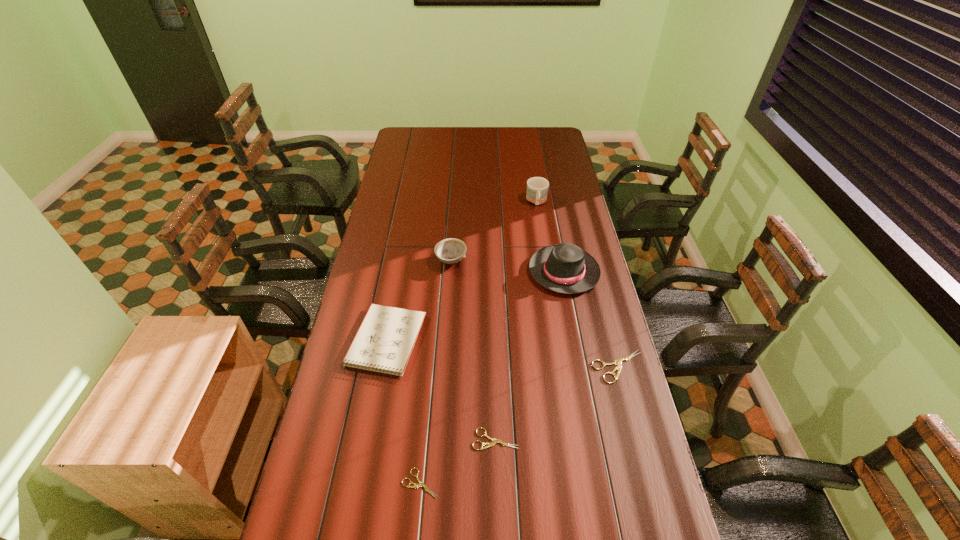
Locate an element on the screen. vacant region between the second shears from left to right and the dress hat is located at coordinates (530, 355).

What are the coordinates of `vacant area that lies between the farthest object and the bowl` in the screenshot? It's located at (493, 231).

Identify the location of vacant area between the rightmost shears and the dress hat. (591, 319).

At what (x,y) coordinates should I click in order to perform the action: click on unoccupied position between the tallest shears and the sixth tallest object. Please return your answer as a coordinate pair (x, y). This screenshot has width=960, height=540. Looking at the image, I should click on (557, 403).

Locate an element on the screen. free spot between the fourth tallest object and the nearest object is located at coordinates (403, 413).

Where is `vacant space in between the dress hat and the second shortest object`? vacant space in between the dress hat and the second shortest object is located at coordinates (530, 355).

At what (x,y) coordinates should I click in order to perform the action: click on free space between the second shortest object and the dress hat. Please return your answer as a coordinate pair (x, y). The width and height of the screenshot is (960, 540). Looking at the image, I should click on (530, 355).

This screenshot has height=540, width=960. I want to click on free spot between the dress hat and the notepad, so click(475, 307).

Identify the location of object that is the sixth closest to the nearest shears. This screenshot has width=960, height=540. (537, 187).

Identify the location of object that ranks as the sixth closest to the fourth tallest object. The image size is (960, 540). (537, 187).